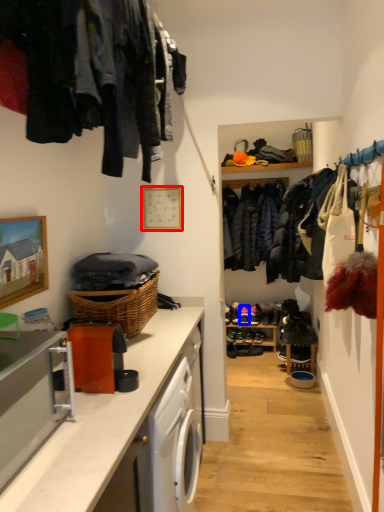
Question: Which object is further to the camera taking this photo, picture frame (highlighted by a red box) or shoe (highlighted by a blue box)?

Choices:
 (A) picture frame
 (B) shoe

Answer: (B)